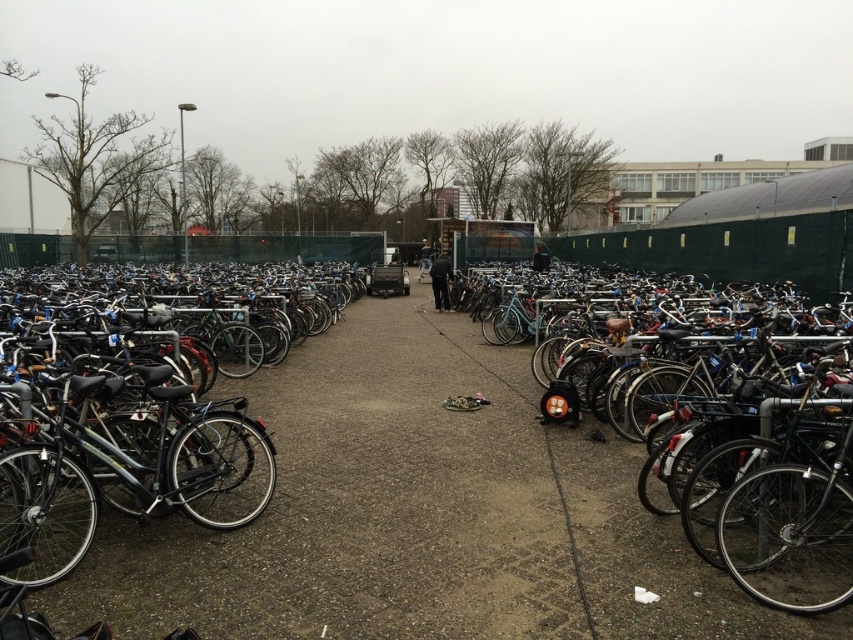
Does shiny black bicycle at left come in front of metallic silver helmet at center?

Yes, it is in front of metallic silver helmet at center.

Is shiny black bicycle at left below metallic silver helmet at center?

Actually, shiny black bicycle at left is above metallic silver helmet at center.

Who is more distant from viewer, (112, 426) or (418, 308)?

Positioned behind is point (418, 308).

I want to click on shiny black bicycle at left, so click(x=126, y=465).

Does point (752, 528) come in front of point (155, 406)?

Yes, point (752, 528) is in front of point (155, 406).

From the picture: Can you confirm if shiny metallic bicycle at right is taller than shiny black bicycle at left?

Yes.

Is point (775, 592) more distant than point (252, 518)?

No, it is in front of (252, 518).

Image resolution: width=853 pixels, height=640 pixels. Find the location of `shiny metallic bicycle at right`. shiny metallic bicycle at right is located at coordinates (758, 497).

Who is positioned more to the right, shiny metallic bicycle at right or metallic silver helmet at center?

shiny metallic bicycle at right is more to the right.

Who is more forward, (659,493) or (549,442)?

Positioned in front is point (659,493).

Locate an element on the screen. The image size is (853, 640). shiny metallic bicycle at right is located at coordinates (758, 497).